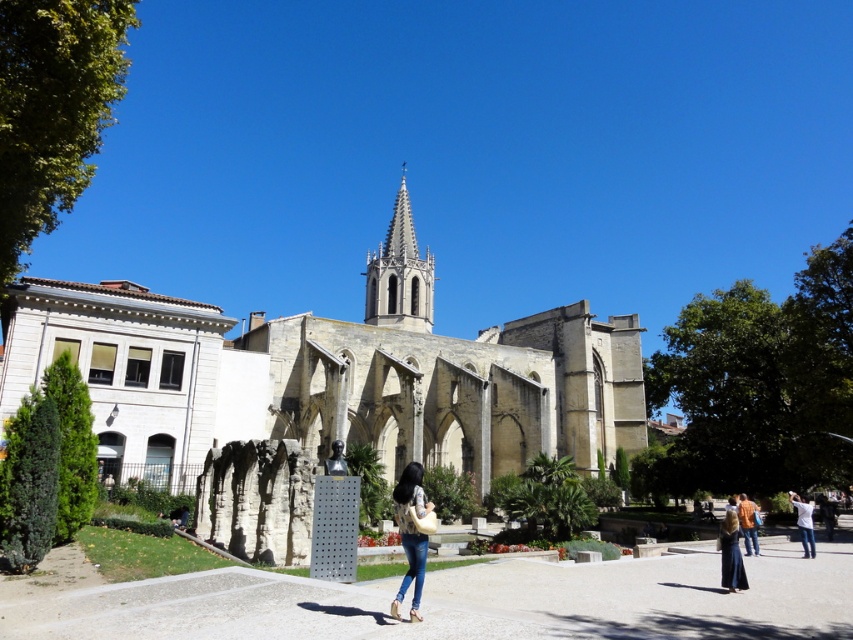
You are a tour guide leading a group to the matte bronze bust at center. A tourist asks if they can walk directly from their current position near the orange cotton jacket at lower right to the bust without crossing any restricted areas. The restricted area is a circular zone with a radius of 30 meters around the bust. Can they walk directly?

The distance between the orange cotton jacket at lower right and the matte bronze bust at center is 29.90 meters, which is just under the 30 meter radius of the restricted area. Therefore, they can walk directly to the bust without entering the restricted zone.

You are standing at point (335, 460) and want to walk to the historic stone structure in the center. Is there a clear path from your current position to the structure without passing through point (808, 509)?

Point (808, 509) is behind point (335, 460), so you can walk towards the historic stone structure in the center without passing through point (808, 509) since it is located behind your current position.